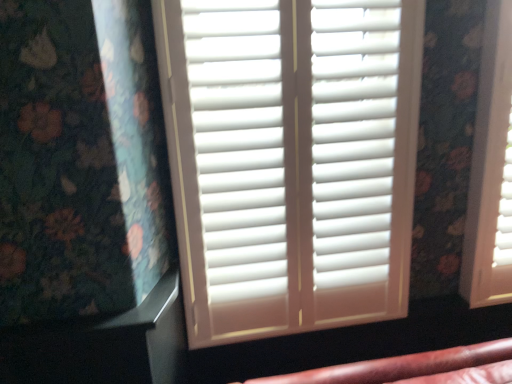
The width and height of the screenshot is (512, 384). What do you see at coordinates (291, 159) in the screenshot? I see `white matte shutters at center` at bounding box center [291, 159].

Where is `white matte shutters at center`? The height and width of the screenshot is (384, 512). white matte shutters at center is located at coordinates (291, 159).

This screenshot has height=384, width=512. Find the location of `white matte shutters at center`. white matte shutters at center is located at coordinates (291, 159).